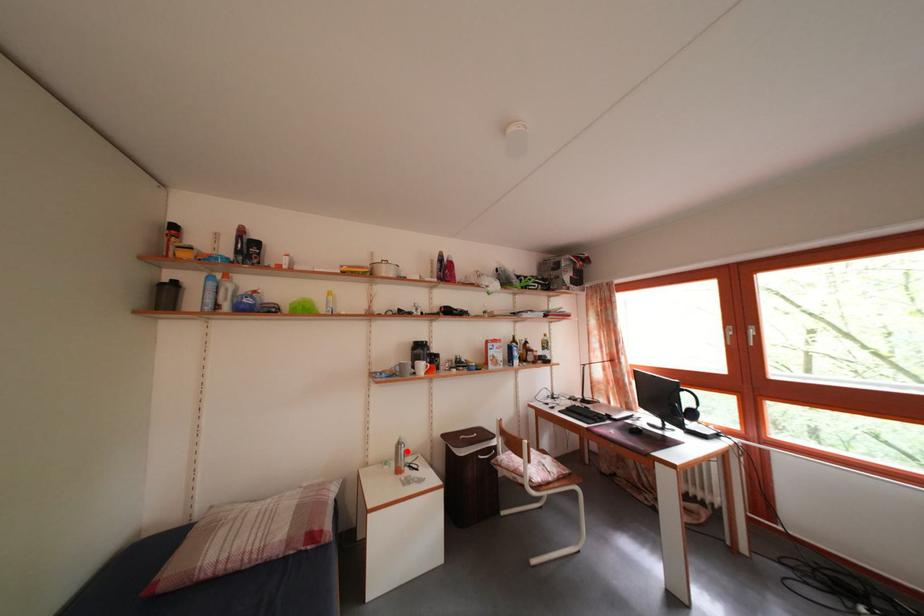
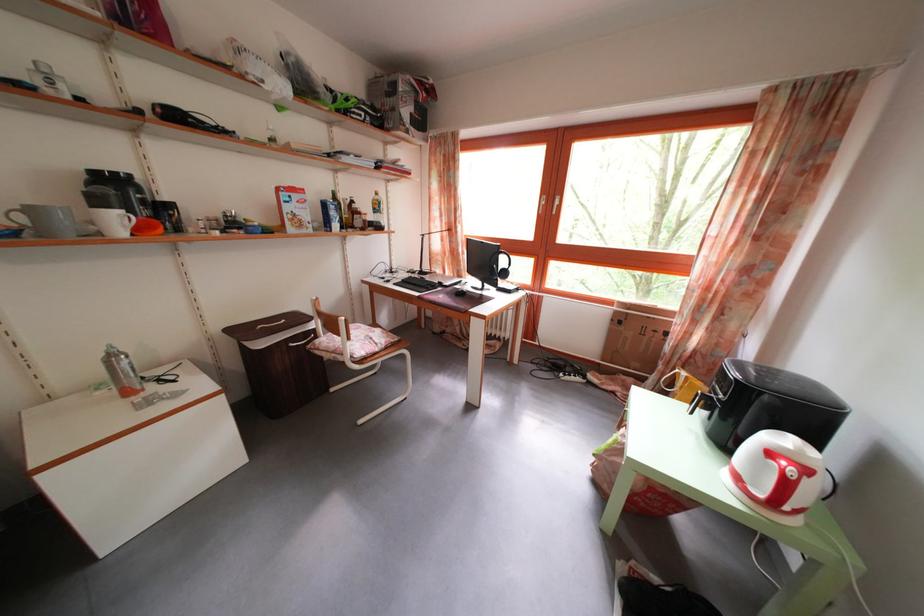
Question: I am providing you with two images of the same scene from different viewpoints. Given a red point in image1, look at the same physical point in image2. Is it:

Choices:
 (A) Closer to the viewpoint
 (B) Farther from the viewpoint

Answer: (A)